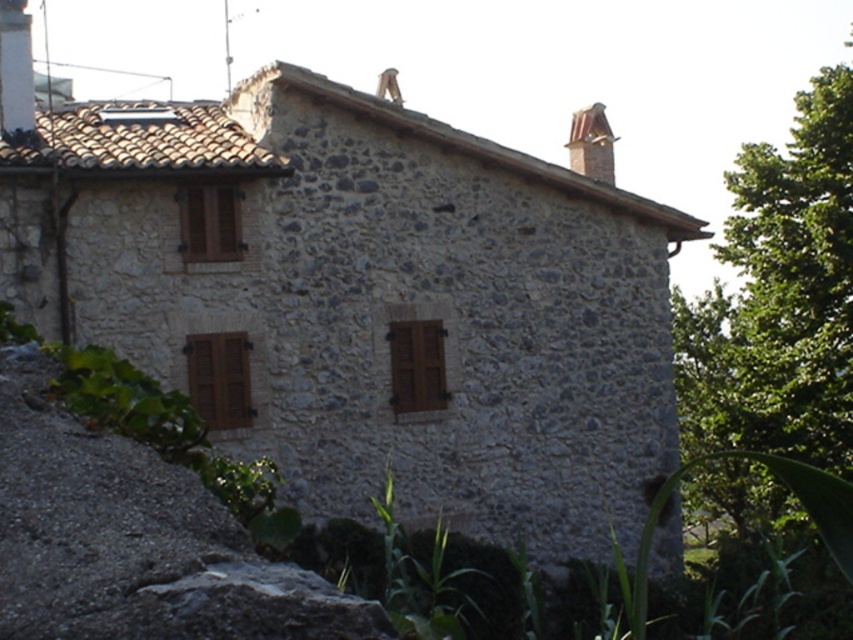
You are standing in front of the rustic stone house and want to determine the spatial relationship between the green leafy tree at right and the smooth terracotta chimney at upper right. Which object is closer to you?

The green leafy tree at right is closer to you because it is further to the viewer than the smooth terracotta chimney at upper right, meaning it appears in front of the chimney.

You are standing in front of the rustic stone house and want to determine the relative positions of two points marked on the roof. Which point is closer to you, point (166, 225) or point (32, 108)?

Point (166, 225) is closer to the viewer than point (32, 108).

You are standing in front of the rustic stone house and notice the green leafy tree at right and the smooth terracotta chimney at upper right. Which object is located higher up in the image?

The green leafy tree at right is positioned over the smooth terracotta chimney at upper right, so it is higher up in the image.